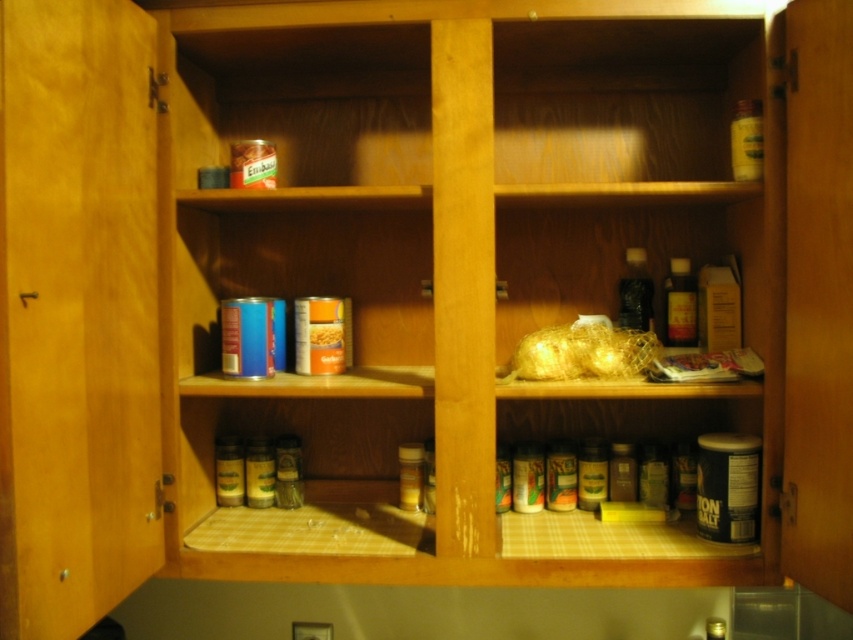
How distant is translucent amber glass bottle at upper right from orange matte can at center?

The distance of translucent amber glass bottle at upper right from orange matte can at center is 25.52 inches.

Who is higher up, translucent amber glass bottle at upper right or orange matte can at center?

Positioned higher is translucent amber glass bottle at upper right.

Find the location of a particular element. translucent amber glass bottle at upper right is located at coordinates (680, 304).

Can you confirm if translucent plastic bottle at upper right is wider than black glass bottle at center-right?

No, translucent plastic bottle at upper right is not wider than black glass bottle at center-right.

Who is more distant from viewer, (751, 106) or (633, 280)?

Positioned behind is point (633, 280).

Image resolution: width=853 pixels, height=640 pixels. Describe the element at coordinates (746, 140) in the screenshot. I see `translucent plastic bottle at upper right` at that location.

The height and width of the screenshot is (640, 853). Identify the location of translucent plastic bottle at upper right. (746, 140).

Who is positioned more to the left, translucent plastic bottle at upper right or orange matte can at center?

From the viewer's perspective, orange matte can at center appears more on the left side.

Does translucent plastic bottle at upper right have a larger size compared to orange matte can at center?

Correct, translucent plastic bottle at upper right is larger in size than orange matte can at center.

Is point (741, 115) less distant than point (340, 346)?

Yes, point (741, 115) is in front of point (340, 346).

Find the location of a particular element. translucent plastic bottle at upper right is located at coordinates (746, 140).